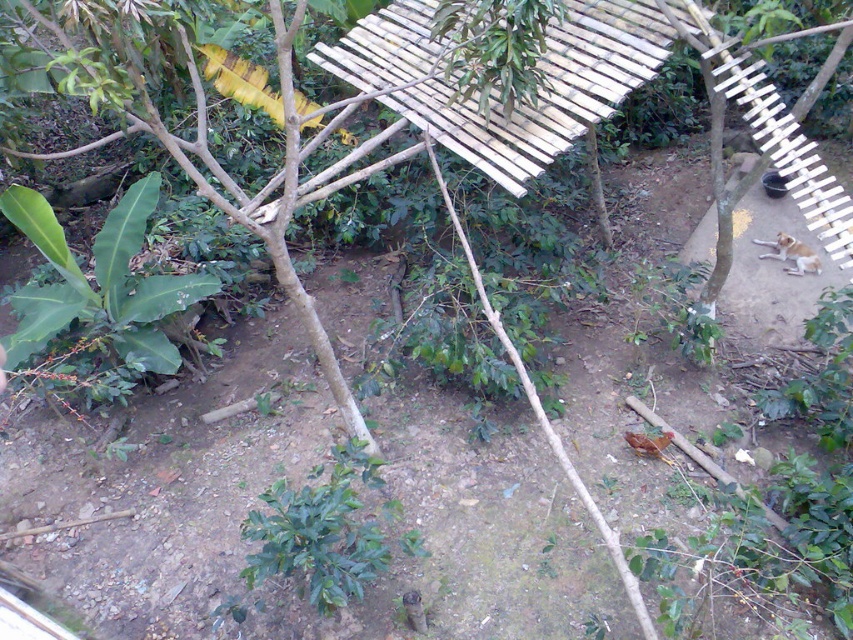
Does wooden slats at center have a lesser width compared to green leafy plant at lower left?

Incorrect, wooden slats at center's width is not less than green leafy plant at lower left's.

This screenshot has height=640, width=853. What do you see at coordinates (490, 100) in the screenshot?
I see `wooden slats at center` at bounding box center [490, 100].

Identify the location of wooden slats at center. The image size is (853, 640). (490, 100).

Is green leafy plant at lower left positioned in front of green leafy plant at center?

That is False.

Between point (114, 209) and point (296, 556), which one is positioned in front?

Positioned in front is point (296, 556).

The height and width of the screenshot is (640, 853). What are the coordinates of `green leafy plant at lower left` in the screenshot? It's located at (99, 282).

Can you confirm if wooden slats at center is positioned below green leafy plant at center?

Incorrect, wooden slats at center is not positioned below green leafy plant at center.

Does wooden slats at center have a lesser height compared to green leafy plant at center?

No, wooden slats at center is not shorter than green leafy plant at center.

Where is `wooden slats at center`? This screenshot has height=640, width=853. wooden slats at center is located at coordinates (490, 100).